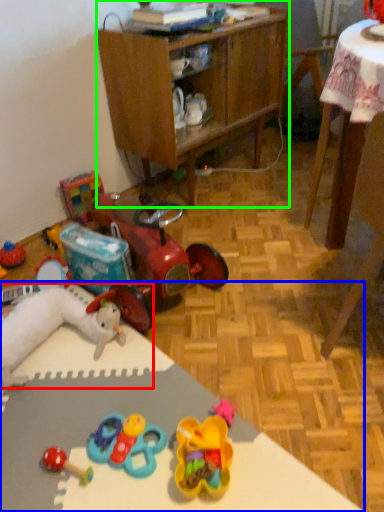
Question: Which object is the closest to the toy (highlighted by a red box)? Choose among these: desk (highlighted by a blue box) or cabinetry (highlighted by a green box).

Choices:
 (A) desk
 (B) cabinetry

Answer: (A)